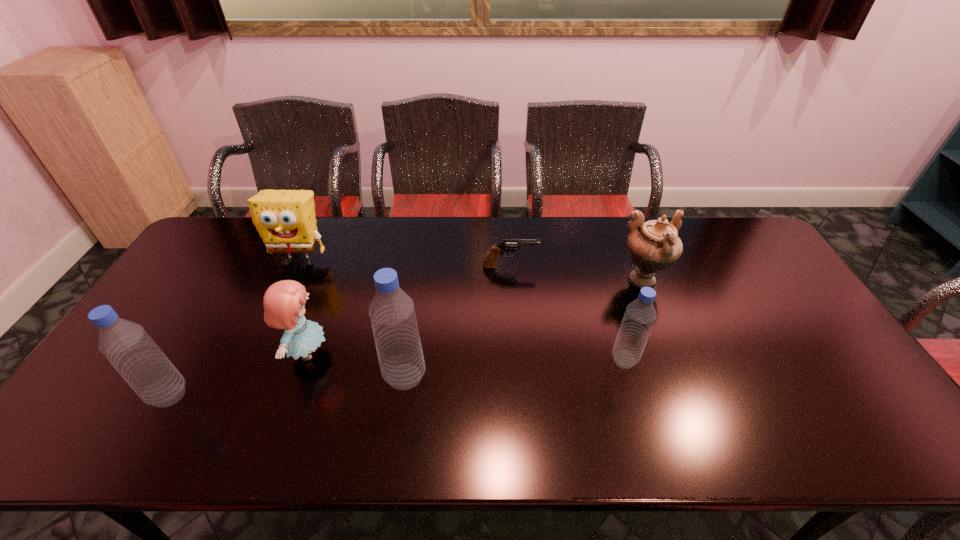
Find the location of a particular element. The width and height of the screenshot is (960, 540). the sixth shortest object is located at coordinates (126, 345).

Where is `the leftmost bottle`? the leftmost bottle is located at coordinates (126, 345).

The height and width of the screenshot is (540, 960). Find the location of `the second bottle from right to left`. the second bottle from right to left is located at coordinates (392, 313).

Image resolution: width=960 pixels, height=540 pixels. Identify the location of the second object from right to left. (640, 314).

Identify the location of the rightmost bottle. (640, 314).

Locate an element on the screen. The height and width of the screenshot is (540, 960). the fifth object from left to right is located at coordinates (508, 245).

Identify the location of the shortest object. Image resolution: width=960 pixels, height=540 pixels. (508, 245).

Locate an element on the screen. The height and width of the screenshot is (540, 960). sponge is located at coordinates (285, 219).

Locate an element on the screen. The image size is (960, 540). doll is located at coordinates [284, 302].

Find the location of `the rightmost object`. the rightmost object is located at coordinates (653, 246).